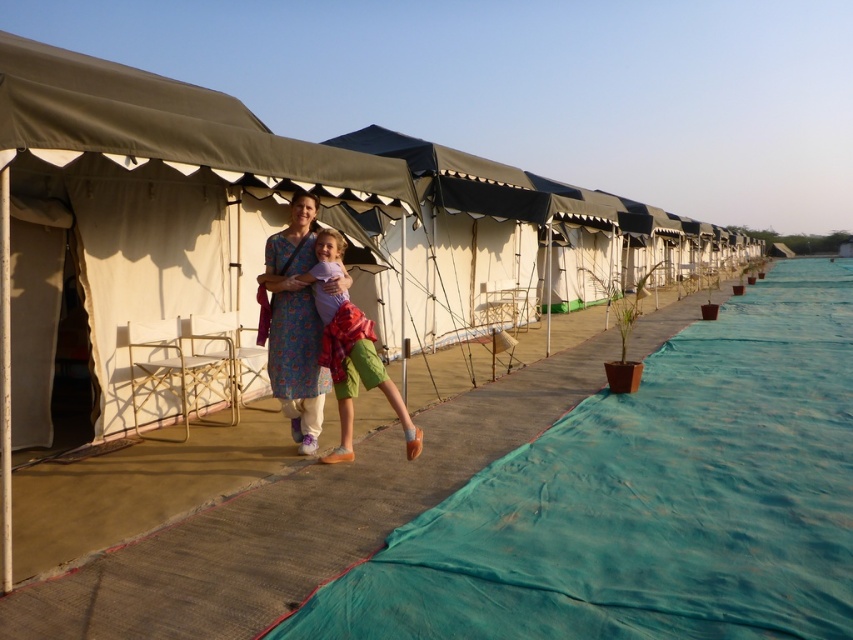
Locate an element on the screen. This screenshot has height=640, width=853. teal fabric ramp at center is located at coordinates (648, 500).

Does teal fabric ramp at center have a larger size compared to matte purple shirt at center?

Yes, teal fabric ramp at center is bigger than matte purple shirt at center.

This screenshot has width=853, height=640. Describe the element at coordinates (648, 500) in the screenshot. I see `teal fabric ramp at center` at that location.

Does point (601, 484) lie behind point (381, 378)?

No, it is not.

Where is `teal fabric ramp at center`? teal fabric ramp at center is located at coordinates (648, 500).

Is floral fabric dress at center smaller than matte purple shirt at center?

Yes, floral fabric dress at center is smaller than matte purple shirt at center.

You are a GUI agent. You are given a task and a screenshot of the screen. Output one action in this format:
    pyautogui.click(x=<x>, y=<y>)
    Task: Click on the floral fabric dress at center
    The height and width of the screenshot is (640, 853).
    Given the screenshot: What is the action you would take?
    pyautogui.click(x=294, y=324)

Is point (286, 278) positioned before point (366, 337)?

No, it is not.

Where is `floral fabric dress at center`? floral fabric dress at center is located at coordinates 294,324.